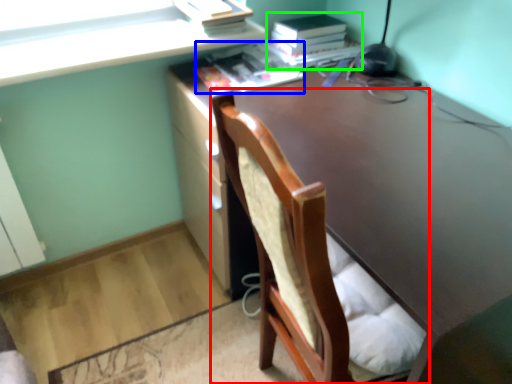
Question: Estimate the real-world distances between objects in this image. Which object is closer to chair (highlighted by a red box), book (highlighted by a blue box) or paperback book (highlighted by a green box)?

Choices:
 (A) book
 (B) paperback book

Answer: (A)